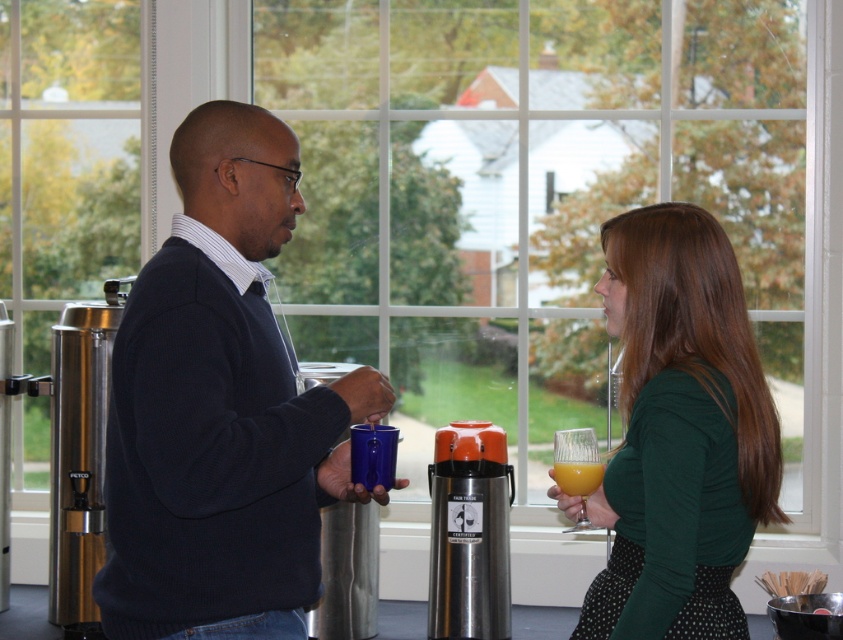
Question: Estimate the real-world distances between objects in this image. Which object is farther from the dark blue sweater at center?

Choices:
 (A) green matte shirt at center
 (B) matte black sweater at center

Answer: (A)

Question: Is the position of dark blue sweater at center less distant than that of green matte shirt at center?

Choices:
 (A) yes
 (B) no

Answer: (A)

Question: Which of the following is the closest to the observer?

Choices:
 (A) green matte shirt at center
 (B) matte black sweater at center
 (C) translucent glass at right

Answer: (B)

Question: Is green matte shirt at center positioned before translucent glass at right?

Choices:
 (A) no
 (B) yes

Answer: (B)

Question: Which of the following is the farthest from the observer?

Choices:
 (A) (643, 580)
 (B) (567, 484)
 (C) (164, 525)
 (D) (353, 400)

Answer: (B)

Question: Is dark blue sweater at center closer to the viewer compared to translucent glass at right?

Choices:
 (A) no
 (B) yes

Answer: (B)